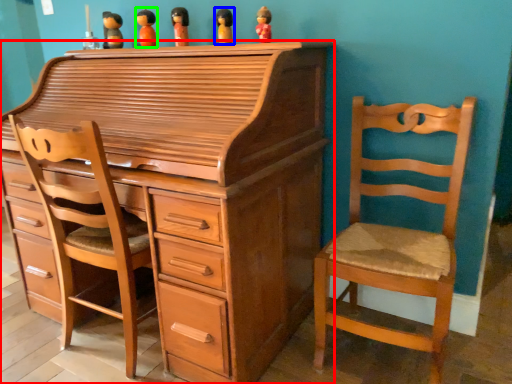
Question: Which object is the closest to the chest of drawers (highlighted by a red box)? Choose among these: toy (highlighted by a blue box) or toy (highlighted by a green box).

Choices:
 (A) toy
 (B) toy

Answer: (A)